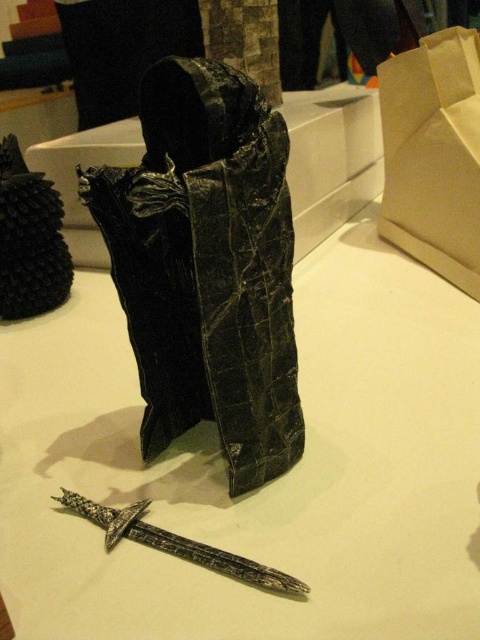
Question: Which object appears closest to the camera in this image?

Choices:
 (A) silver metallic sword at center
 (B) leather-like black armor at center

Answer: (B)

Question: Estimate the real-world distances between objects in this image. Which object is farther from the brown/kraft paper bag at upper right?

Choices:
 (A) leather-like black armor at center
 (B) silver metallic sword at center

Answer: (B)

Question: Can you confirm if leather-like black armor at center is wider than brown/kraft paper bag at upper right?

Choices:
 (A) no
 (B) yes

Answer: (B)

Question: Does leather-like black armor at center lie in front of brown/kraft paper bag at upper right?

Choices:
 (A) yes
 (B) no

Answer: (A)

Question: Can you confirm if brown/kraft paper bag at upper right is positioned to the left of silver metallic sword at center?

Choices:
 (A) yes
 (B) no

Answer: (B)

Question: Which object is the farthest from the leather-like black armor at center?

Choices:
 (A) white matte table at center
 (B) brown/kraft paper bag at upper right

Answer: (B)